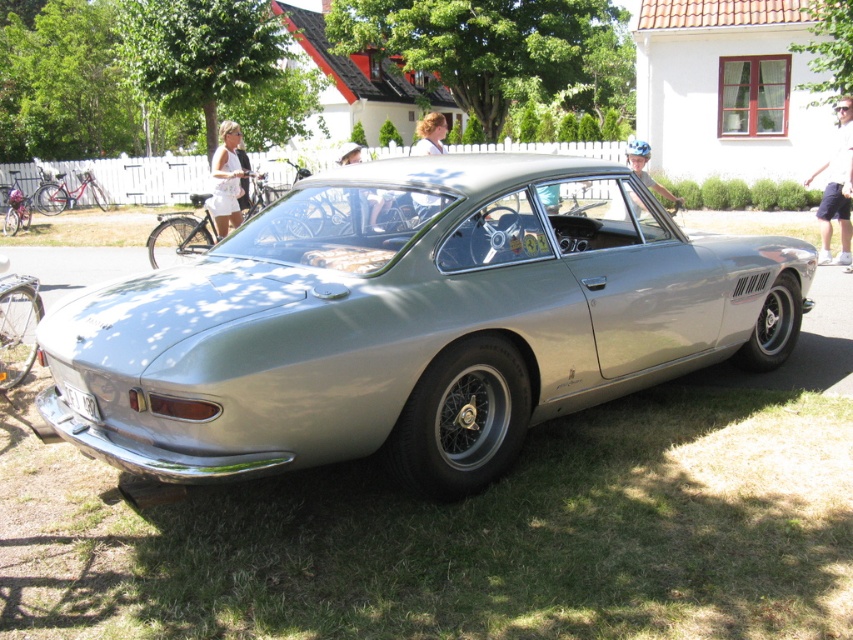
Can you confirm if white shorts at right is positioned below light beige fabric shirt at center?

Correct, white shorts at right is located below light beige fabric shirt at center.

Is point (846, 163) farther from camera compared to point (376, 205)?

That is True.

Which is in front, point (844, 244) or point (344, 157)?

Point (344, 157)

At what (x,y) coordinates should I click in order to perform the action: click on white shorts at right. Please return your answer as a coordinate pair (x, y). The height and width of the screenshot is (640, 853). Looking at the image, I should click on (836, 188).

Does satin silver car at center have a greater height compared to light blue helmet at center?

No.

Does point (567, 259) come behind point (634, 200)?

No, it is not.

You are a GUI agent. You are given a task and a screenshot of the screen. Output one action in this format:
    pyautogui.click(x=<x>, y=<y>)
    Task: Click on the satin silver car at center
    
    Given the screenshot: What is the action you would take?
    pyautogui.click(x=410, y=323)

Based on the photo, does satin silver car at center have a larger size compared to white fabric dress at upper center?

Yes, satin silver car at center is bigger than white fabric dress at upper center.

Consider the image. Which is below, satin silver car at center or white fabric dress at upper center?

Positioned lower is satin silver car at center.

Measure the distance between point (x=393, y=259) and camera.

They are 12.83 feet apart.

This screenshot has width=853, height=640. I want to click on satin silver car at center, so 410,323.